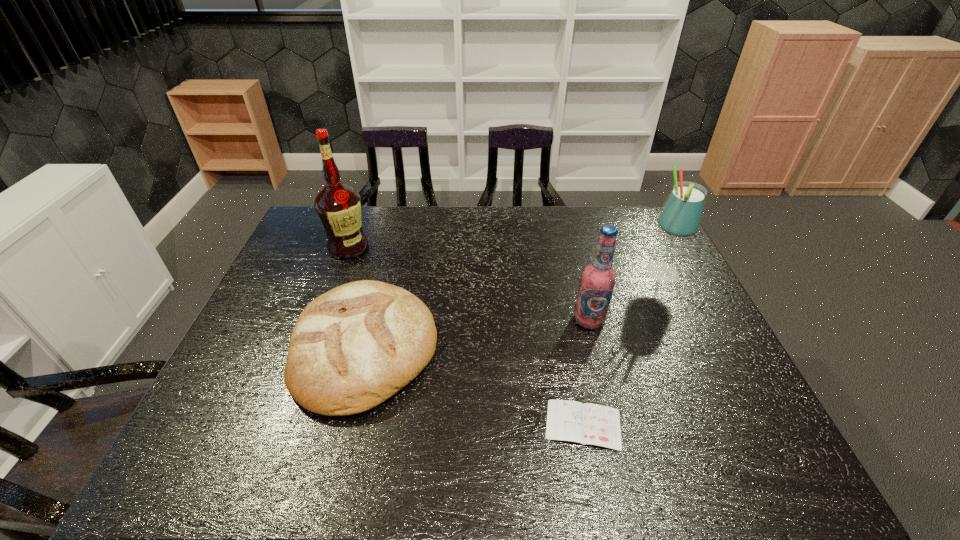
At what (x,y) coordinates should I click in order to perform the action: click on vacant space at the right edge. Please return your answer as a coordinate pair (x, y). This screenshot has height=540, width=960. Looking at the image, I should click on (683, 279).

This screenshot has width=960, height=540. In order to click on vacant space at the far right corner of the desktop in this screenshot , I will do `click(647, 207)`.

Where is `free space between the leftmost alcohol and the diary`? This screenshot has width=960, height=540. free space between the leftmost alcohol and the diary is located at coordinates (466, 336).

Where is `free space between the leftmost alcohol and the third shortest object`? Image resolution: width=960 pixels, height=540 pixels. free space between the leftmost alcohol and the third shortest object is located at coordinates pos(468,284).

This screenshot has height=540, width=960. What are the coordinates of `empty space that is in between the diary and the rightmost object` in the screenshot? It's located at (622, 349).

The image size is (960, 540). I want to click on vacant area that lies between the leftmost alcohol and the rightmost object, so click(x=505, y=261).

I want to click on free space between the shortest object and the fourth tallest object, so click(x=474, y=387).

Image resolution: width=960 pixels, height=540 pixels. I want to click on free spot between the leftmost alcohol and the rightmost object, so click(505, 261).

At what (x,y) coordinates should I click in order to perform the action: click on vacant space in between the rightmost alcohol and the second alcohol from left to right. Please return your answer as a coordinate pair (x, y). Looking at the image, I should click on (625, 297).

This screenshot has height=540, width=960. I want to click on free spot between the fourth tallest object and the rightmost alcohol, so click(x=514, y=311).